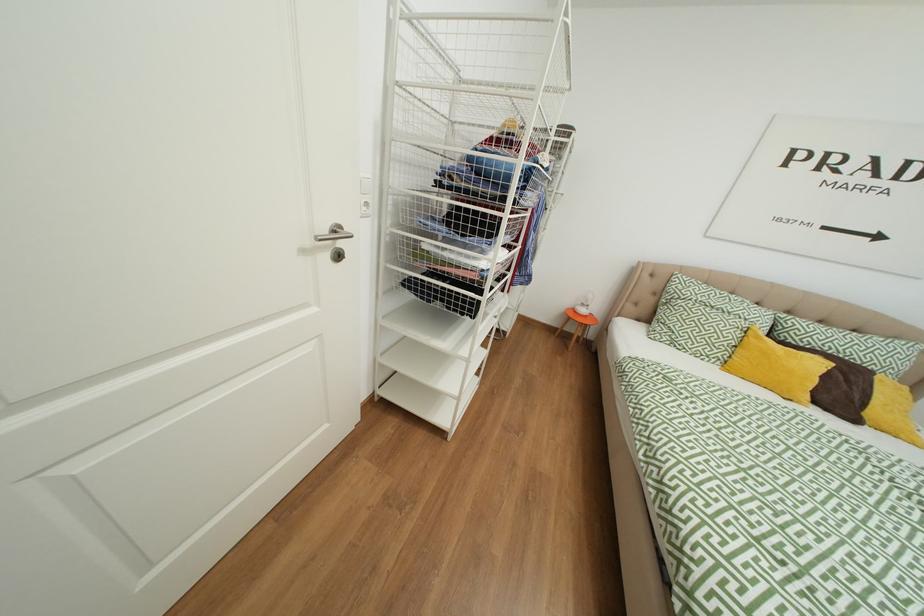
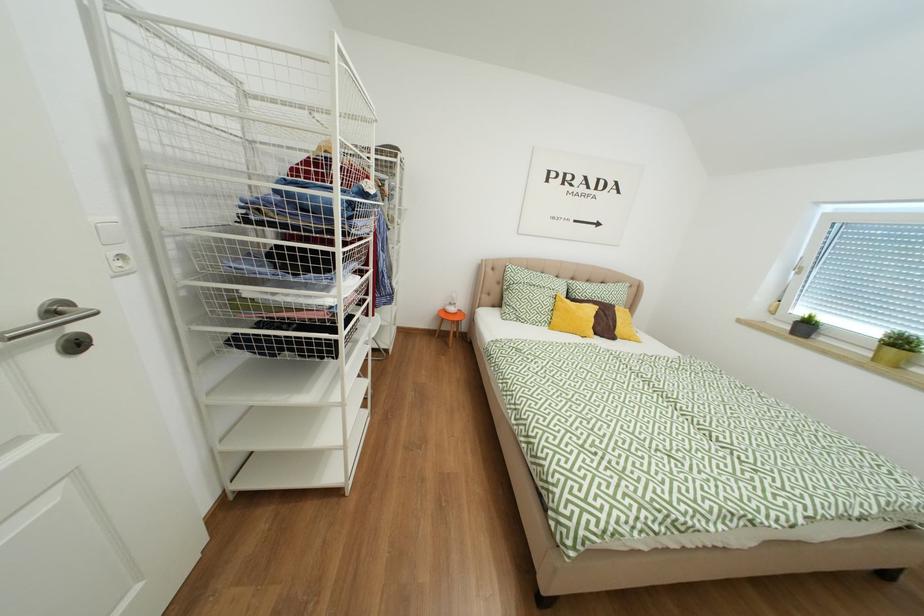
Question: The camera is either moving clockwise (left) or counter-clockwise (right) around the object. The first image is from the beginning of the video and the second image is from the end. Is the camera moving left or right when shooting the video?

Choices:
 (A) Left
 (B) Right

Answer: (A)